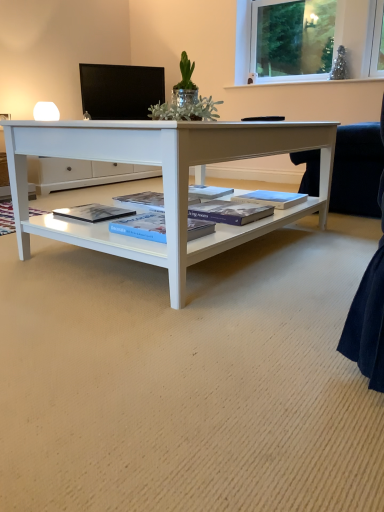
Question: Is blue matte book at center, which is counted as the third magazine, starting from the left, shorter than black glossy monitor at upper center?

Choices:
 (A) yes
 (B) no

Answer: (A)

Question: From the image's perspective, is blue matte book at center, acting as the 2th magazine starting from the right, located beneath black glossy monitor at upper center?

Choices:
 (A) yes
 (B) no

Answer: (A)

Question: Can you confirm if blue matte book at center, which is counted as the third magazine, starting from the left, is thinner than black glossy monitor at upper center?

Choices:
 (A) yes
 (B) no

Answer: (B)

Question: From a real-world perspective, is blue matte book at center, acting as the 2th magazine starting from the right, positioned under black glossy monitor at upper center based on gravity?

Choices:
 (A) yes
 (B) no

Answer: (A)

Question: Is black glossy monitor at upper center at the back of blue matte book at center, acting as the 2th magazine starting from the right?

Choices:
 (A) no
 (B) yes

Answer: (A)

Question: Considering the relative sizes of blue matte book at center, acting as the 2th magazine starting from the right, and black glossy monitor at upper center in the image provided, is blue matte book at center, acting as the 2th magazine starting from the right, smaller than black glossy monitor at upper center?

Choices:
 (A) yes
 (B) no

Answer: (A)

Question: From a real-world perspective, is blue glossy book at center, which ranks as the 2th magazine in left-to-right order, under clear glass window at upper right?

Choices:
 (A) no
 (B) yes

Answer: (B)

Question: Is blue glossy book at center, which ranks as the 2th magazine in left-to-right order, shorter than clear glass window at upper right?

Choices:
 (A) yes
 (B) no

Answer: (A)

Question: Does blue glossy book at center, which appears as the 3th magazine when viewed from the right, lie behind clear glass window at upper right?

Choices:
 (A) yes
 (B) no

Answer: (B)

Question: Considering the relative sizes of blue glossy book at center, which appears as the 3th magazine when viewed from the right, and clear glass window at upper right in the image provided, is blue glossy book at center, which appears as the 3th magazine when viewed from the right, bigger than clear glass window at upper right?

Choices:
 (A) no
 (B) yes

Answer: (A)

Question: From the image's perspective, is blue glossy book at center, which ranks as the 2th magazine in left-to-right order, located above clear glass window at upper right?

Choices:
 (A) yes
 (B) no

Answer: (B)

Question: Does blue glossy book at center, which ranks as the 2th magazine in left-to-right order, have a greater width compared to clear glass window at upper right?

Choices:
 (A) no
 (B) yes

Answer: (B)

Question: From the image's perspective, is black glossy monitor at upper center under matte blue magazine at center, which ranks as the 4th magazine in left-to-right order?

Choices:
 (A) no
 (B) yes

Answer: (A)